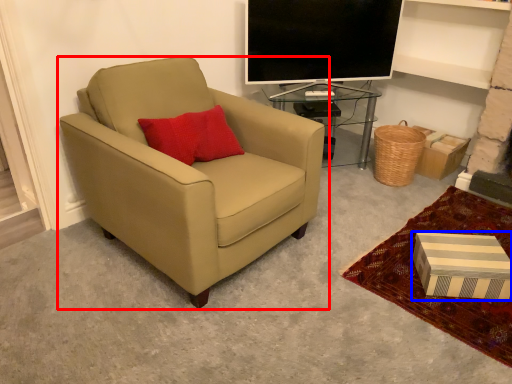
Question: Among these objects, which one is nearest to the camera, chair (highlighted by a red box) or box (highlighted by a blue box)?

Choices:
 (A) chair
 (B) box

Answer: (A)